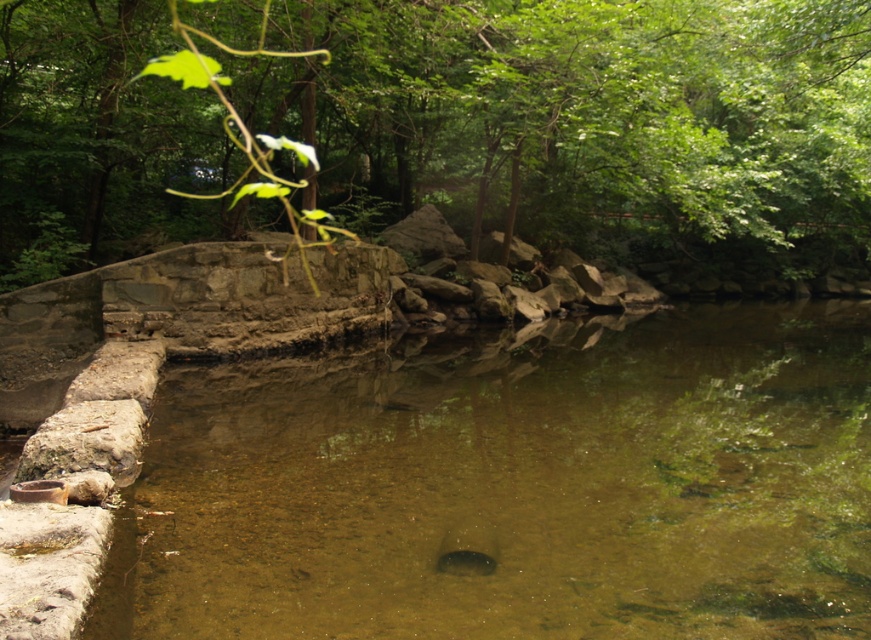
Which of these two, clear water at center or green leafy tree at upper center, stands taller?

With more height is green leafy tree at upper center.

Does point (476, 417) come farther from viewer compared to point (42, 12)?

No, it is in front of (42, 12).

You are a GUI agent. You are given a task and a screenshot of the screen. Output one action in this format:
    pyautogui.click(x=<x>, y=<y>)
    Task: Click on the clear water at center
    The height and width of the screenshot is (640, 871).
    Given the screenshot: What is the action you would take?
    (514, 484)